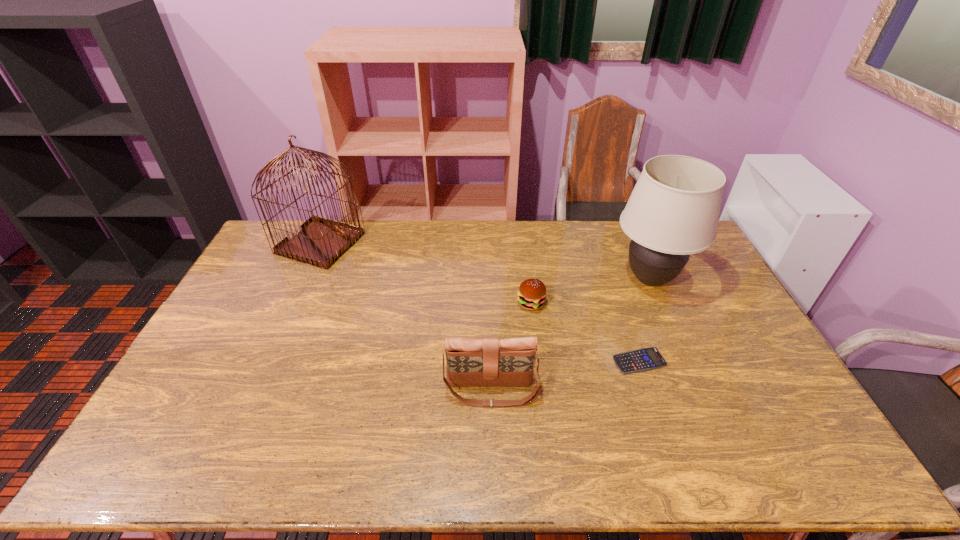
You are a GUI agent. You are given a task and a screenshot of the screen. Output one action in this format:
    pyautogui.click(x=<x>, y=<y>)
    Task: Click on the birdcage that is at the far edge
    
    Given the screenshot: What is the action you would take?
    pyautogui.click(x=321, y=242)

This screenshot has width=960, height=540. In order to click on lampshade that is at the far edge in this screenshot , I will do `click(673, 211)`.

Image resolution: width=960 pixels, height=540 pixels. I want to click on object situated at the left edge, so click(x=321, y=242).

Image resolution: width=960 pixels, height=540 pixels. I want to click on object situated at the right edge, so click(x=673, y=211).

I want to click on object that is at the far left corner, so click(x=321, y=242).

Locate an element on the screen. object present at the far right corner is located at coordinates (673, 211).

Identify the location of vacant space at the far edge of the desktop. This screenshot has height=540, width=960. (561, 238).

In the image, there is a desktop. Where is `vacant space at the near edge`? This screenshot has height=540, width=960. vacant space at the near edge is located at coordinates (639, 463).

This screenshot has height=540, width=960. Find the location of `vacant space at the left edge of the desktop`. vacant space at the left edge of the desktop is located at coordinates (253, 301).

Where is `vacant space at the right edge`? The height and width of the screenshot is (540, 960). vacant space at the right edge is located at coordinates (747, 348).